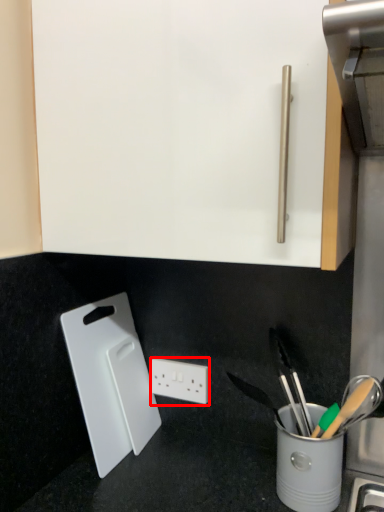
Question: In this image, where is power plugs and sockets (annotated by the red box) located relative to cutting board?

Choices:
 (A) right
 (B) left

Answer: (A)